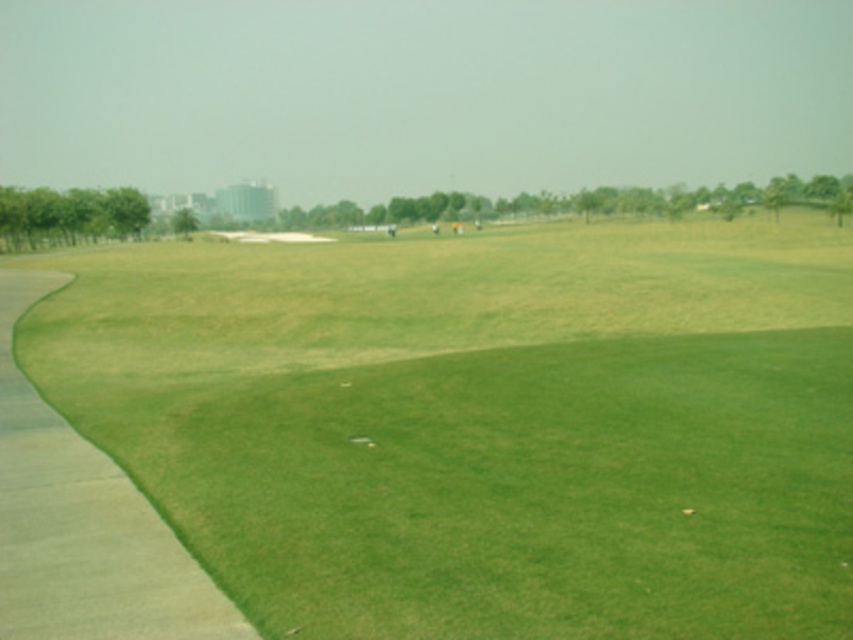
Is point (456, 413) positioned before point (173, 560)?

That is False.

Is point (306, 490) more distant than point (123, 573)?

That is True.

Where is `green grass at center`? green grass at center is located at coordinates (485, 422).